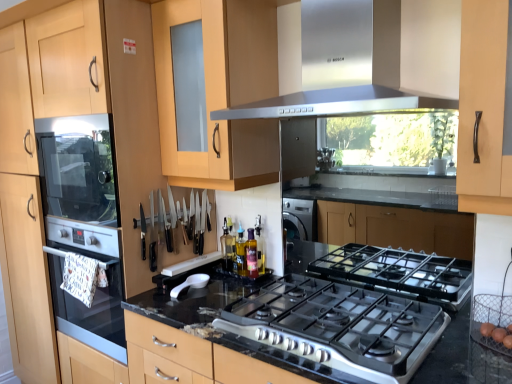
Question: Is translucent glass bottle at center, the first bottle when ordered from left to right, surrounded by stainless steel range hood at upper center?

Choices:
 (A) yes
 (B) no

Answer: (B)

Question: Can you confirm if stainless steel range hood at upper center is taller than translucent glass bottle at center, marked as the 1th bottle in a back-to-front arrangement?

Choices:
 (A) no
 (B) yes

Answer: (B)

Question: From a real-world perspective, is stainless steel range hood at upper center below translucent glass bottle at center, marked as the 1th bottle in a back-to-front arrangement?

Choices:
 (A) yes
 (B) no

Answer: (B)

Question: From a real-world perspective, is stainless steel range hood at upper center on translucent glass bottle at center, the first bottle when ordered from left to right?

Choices:
 (A) yes
 (B) no

Answer: (A)

Question: Does stainless steel range hood at upper center appear on the left side of translucent glass bottle at center, acting as the second bottle starting from the front?

Choices:
 (A) yes
 (B) no

Answer: (B)

Question: Does point (273, 117) appear closer or farther from the camera than point (57, 380)?

Choices:
 (A) farther
 (B) closer

Answer: (B)

Question: From a real-world perspective, is stainless steel range hood at upper center above or below light wood/texture cabinet at left?

Choices:
 (A) below
 (B) above

Answer: (B)

Question: In the image, is stainless steel range hood at upper center positioned in front of or behind light wood/texture cabinet at left?

Choices:
 (A) front
 (B) behind

Answer: (A)

Question: Looking at the image, does stainless steel range hood at upper center seem bigger or smaller compared to light wood/texture cabinet at left?

Choices:
 (A) big
 (B) small

Answer: (B)

Question: From the image's perspective, is stainless steel range hood at upper center positioned above or below black plastic knives at center?

Choices:
 (A) above
 (B) below

Answer: (A)

Question: Looking at their shapes, would you say stainless steel range hood at upper center is wider or thinner than black plastic knives at center?

Choices:
 (A) wide
 (B) thin

Answer: (A)

Question: Does point [266, 105] appear closer or farther from the camera than point [172, 218]?

Choices:
 (A) closer
 (B) farther

Answer: (A)

Question: Looking at the image, does stainless steel range hood at upper center seem bigger or smaller compared to black plastic knives at center?

Choices:
 (A) small
 (B) big

Answer: (B)

Question: Is translucent glass bottle at center, placed as the 1th bottle when sorted from right to left, inside or outside of white plastic spoon at center?

Choices:
 (A) outside
 (B) inside

Answer: (A)

Question: In the image, is translucent glass bottle at center, which ranks as the second bottle in left-to-right order, positioned in front of or behind white plastic spoon at center?

Choices:
 (A) front
 (B) behind

Answer: (B)